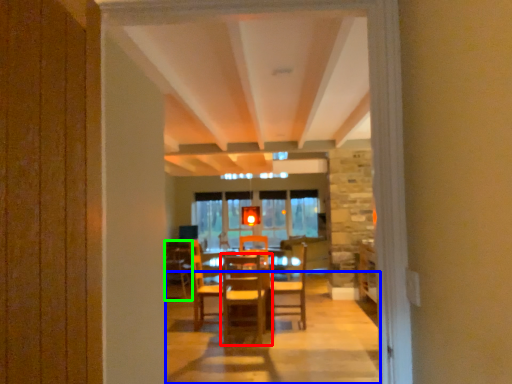
Question: Based on their relative distances, which object is nearer to chair (highlighted by a red box)? Choose from path (highlighted by a blue box) and armchair (highlighted by a green box).

Choices:
 (A) path
 (B) armchair

Answer: (A)